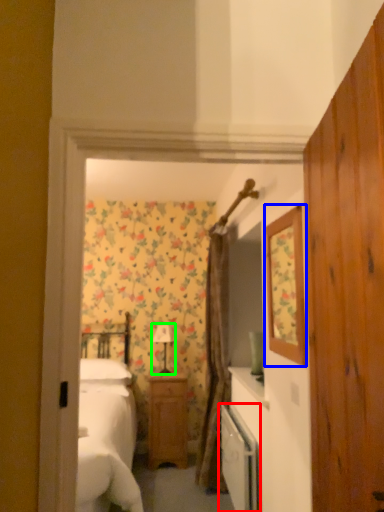
Question: Estimate the real-world distances between objects in this image. Which object is farther from dish washer (highlighted by a red box), mirror (highlighted by a blue box) or lamp (highlighted by a green box)?

Choices:
 (A) mirror
 (B) lamp

Answer: (B)